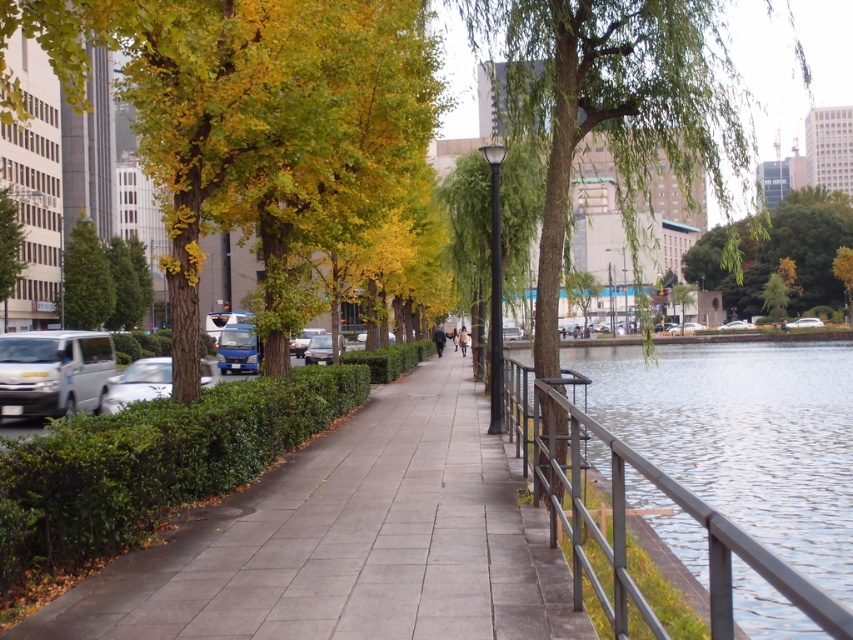
Is point (692, 83) closer to viewer compared to point (317, 339)?

Yes, it is in front of point (317, 339).

This screenshot has height=640, width=853. I want to click on green leafy tree at center, so click(608, 106).

This screenshot has height=640, width=853. Identify the location of green leafy tree at center. (608, 106).

Who is more forward, (403, 634) or (720, 52)?

Positioned in front is point (403, 634).

Is point (132, 564) behind point (706, 93)?

No.

At what (x,y) coordinates should I click in order to perform the action: click on gray concrete pavement at center. Please return your answer as a coordinate pair (x, y). Looking at the image, I should click on [x=350, y=540].

Can you confirm if green matte tree at left is wider than silver metallic car at left?

Indeed, green matte tree at left has a greater width compared to silver metallic car at left.

Is point (88, 269) farther from viewer compared to point (125, 396)?

Yes, it is.

Locate an element on the screen. green matte tree at left is located at coordinates [86, 278].